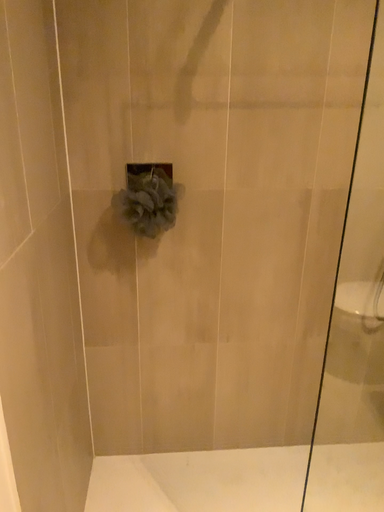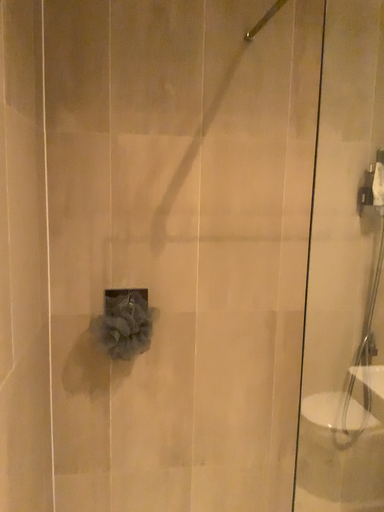
Question: How did the camera likely rotate when shooting the video?

Choices:
 (A) rotated downward
 (B) rotated upward

Answer: (B)